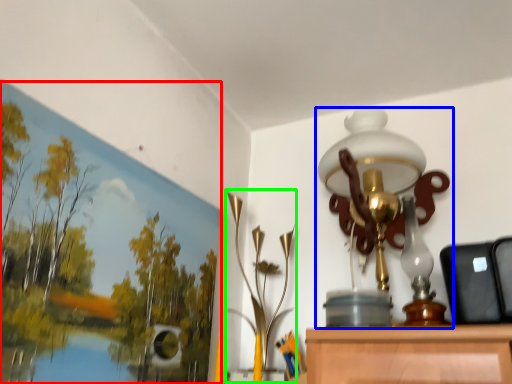
Question: Which object is the farthest from oil painting (highlighted by a red box)? Choose among these: lamp (highlighted by a blue box) or lamp (highlighted by a green box).

Choices:
 (A) lamp
 (B) lamp

Answer: (A)